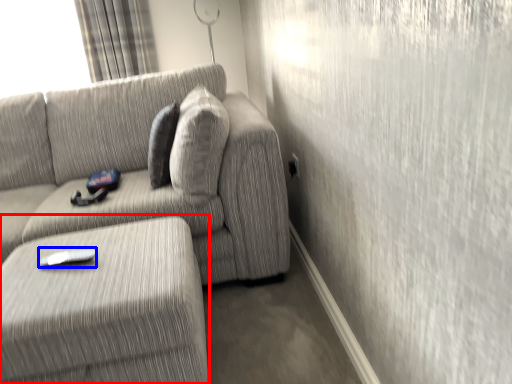
Question: Among these objects, which one is nearest to the camera, table (highlighted by a red box) or remote (highlighted by a blue box)?

Choices:
 (A) table
 (B) remote

Answer: (A)